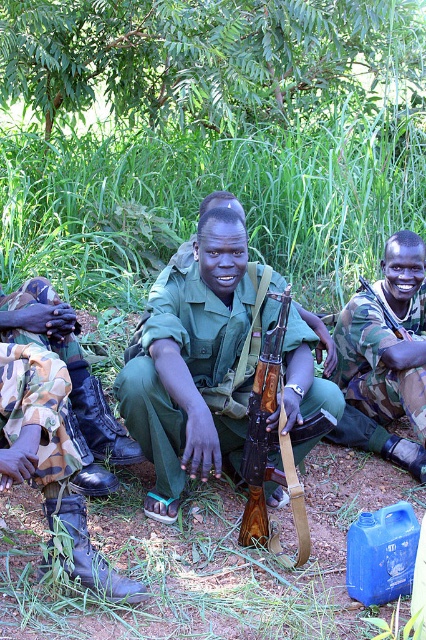
You are a photographer trying to capture a clear shot of the wooden rifle at center without any obstruction. The green leafy tree at upper center is in your way. Can you adjust your position to avoid the tree?

The green leafy tree at upper center is taller than the wooden rifle at center, so if you lower your camera angle or move to a lower position, you can avoid the tree and get a clear shot of the wooden rifle at center.

You are a photographer trying to capture a clear shot of the central figure in the scene. There is a green leafy tree at upper center. Where is the green leafy tree positioned relative to the central figure?

The green leafy tree at upper center is located at point [203,54], which places it above and slightly to the left of the central figure.

You are a photographer trying to capture a clear shot of the green matte uniform at center and the black leather boots at lower left. Which object should you focus on first if you want to ensure both are in focus, considering their positions?

The green matte uniform at center has a greater height compared to the black leather boots at lower left, so focusing on the green matte uniform at center first would ensure both are in focus since it is taller and likely closer to the camera.